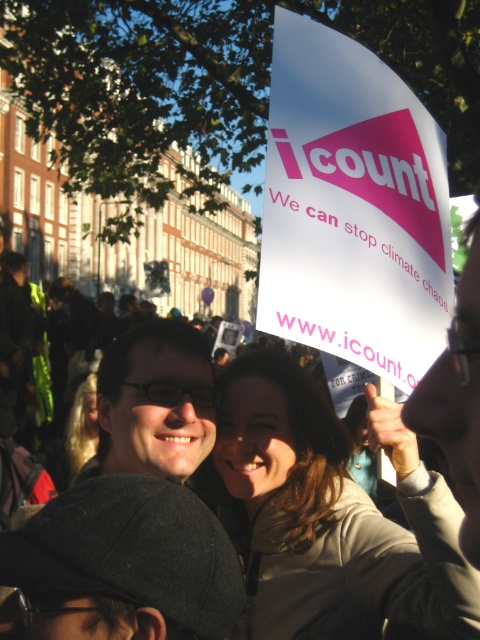
Is matte black glasses at center below blonde hair at lower left?

Yes, matte black glasses at center is below blonde hair at lower left.

Is point (144, 504) farther from camera compared to point (78, 440)?

No.

Identify the location of matte black glasses at center. Image resolution: width=480 pixels, height=640 pixels. (141, 496).

Is point (441, 605) positioned in front of point (163, 456)?

Yes, it is.

Does matte beige coat at center have a lesser width compared to matte black glasses at center?

No.

At what (x,y) coordinates should I click in order to perform the action: click on matte beige coat at center. Please return your answer as a coordinate pair (x, y). Looking at the image, I should click on (327, 518).

Locate an element on the screen. Image resolution: width=480 pixels, height=640 pixels. matte beige coat at center is located at coordinates (327, 518).

Who is more forward, (331, 557) or (87, 406)?

Point (331, 557) is more forward.

Is matte beige coat at center wider than blonde hair at lower left?

Yes.

I want to click on matte beige coat at center, so click(x=327, y=518).

You are a GUI agent. You are given a task and a screenshot of the screen. Output one action in this format:
    pyautogui.click(x=<x>, y=<y>)
    Task: Click on the matte beige coat at center
    
    Given the screenshot: What is the action you would take?
    pyautogui.click(x=327, y=518)